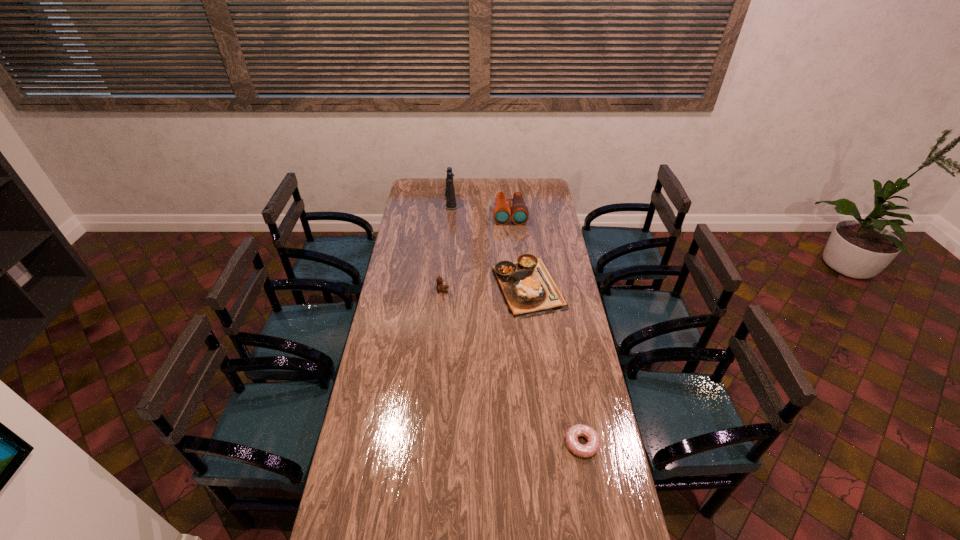
Find the location of a particular element. The image size is (960, 540). free location that satisfies the following two spatial constraints: 1. at the face of the teddy bear; 2. on the left side of the nearest object is located at coordinates (429, 444).

Locate an element on the screen. The image size is (960, 540). free space that satisfies the following two spatial constraints: 1. on the front side of the second shortest object; 2. at the face of the teddy bear is located at coordinates (528, 290).

You are a GUI agent. You are given a task and a screenshot of the screen. Output one action in this format:
    pyautogui.click(x=<x>, y=<y>)
    Task: Click on the vacant area that satisfies the following two spatial constraints: 1. at the face of the doughnut; 2. on the left side of the third shortest object
    The height and width of the screenshot is (540, 960).
    Given the screenshot: What is the action you would take?
    pyautogui.click(x=429, y=444)

I want to click on free space that satisfies the following two spatial constraints: 1. through the lenses of the shorter binoculars; 2. on the right side of the fourth tallest object, so click(x=516, y=287).

Find the location of `free spot that satisfies the following two spatial constraints: 1. on the front side of the shortest object; 2. on the right side of the platter`. free spot that satisfies the following two spatial constraints: 1. on the front side of the shortest object; 2. on the right side of the platter is located at coordinates (545, 444).

The height and width of the screenshot is (540, 960). What are the coordinates of `vacant point that satisfies the following two spatial constraints: 1. on the back side of the nearest object; 2. at the face of the teddy bear` in the screenshot? It's located at (554, 290).